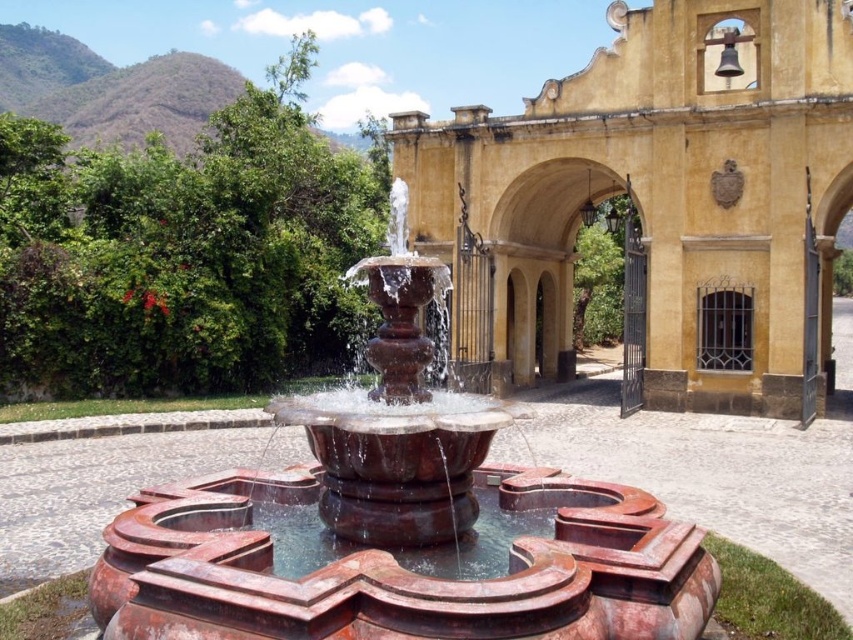
You are standing in the courtyard and want to take a photo of the matte yellow stone church at center and the rustic terracotta fountain at center. Which object should you aim your camera at first if you want to capture both in a single shot without moving the camera?

You should aim your camera at the rustic terracotta fountain at center first because the matte yellow stone church at center is located above it, so by focusing on the fountain, you can include both objects in the frame without moving the camera.

You are planning to place a new bench in the courtyard between the matte yellow stone church at center and the rustic terracotta fountain at center. If the bench is 1.2 meters wide, can it fit in the space between them without touching either structure?

The matte yellow stone church at center might be wider than rustic terracotta fountain at center, so it is uncertain if the bench will fit. Check the actual width of both structures before deciding.

You are standing in the courtyard and want to take a photo of both the matte yellow stone church at center and the rustic terracotta fountain at center. Which object will appear larger in the photo?

The matte yellow stone church at center will appear larger in the photo because it is much taller than the rustic terracotta fountain at center.